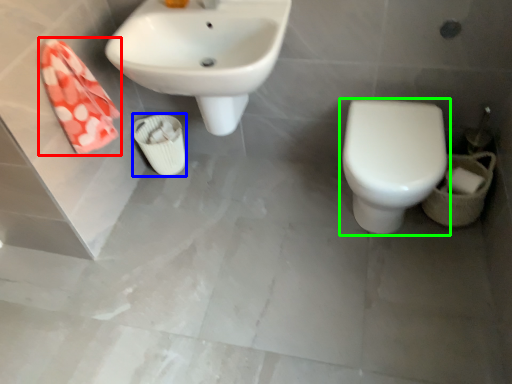
Question: Which object is the farthest from hand towel (highlighted by a red box)? Choose among these: porcelain (highlighted by a blue box) or toilet (highlighted by a green box).

Choices:
 (A) porcelain
 (B) toilet

Answer: (B)